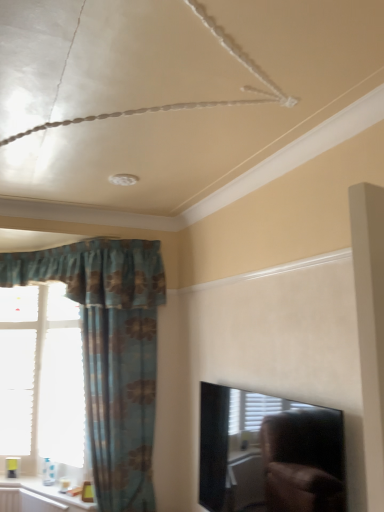
Question: From a real-world perspective, is white glossy window sill at lower left above or below black glossy tv at upper right?

Choices:
 (A) above
 (B) below

Answer: (B)

Question: Considering the positions of white glossy window sill at lower left and black glossy tv at upper right in the image, is white glossy window sill at lower left wider or thinner than black glossy tv at upper right?

Choices:
 (A) wide
 (B) thin

Answer: (A)

Question: Which is farther from the black glossy tv at upper right?

Choices:
 (A) white paper at left
 (B) blue floral fabric curtain at left
 (C) white glossy window sill at lower left

Answer: (A)

Question: Which of these objects is positioned closest to the blue floral fabric curtain at left?

Choices:
 (A) white paper at left
 (B) white glossy window sill at lower left
 (C) black glossy tv at upper right

Answer: (A)